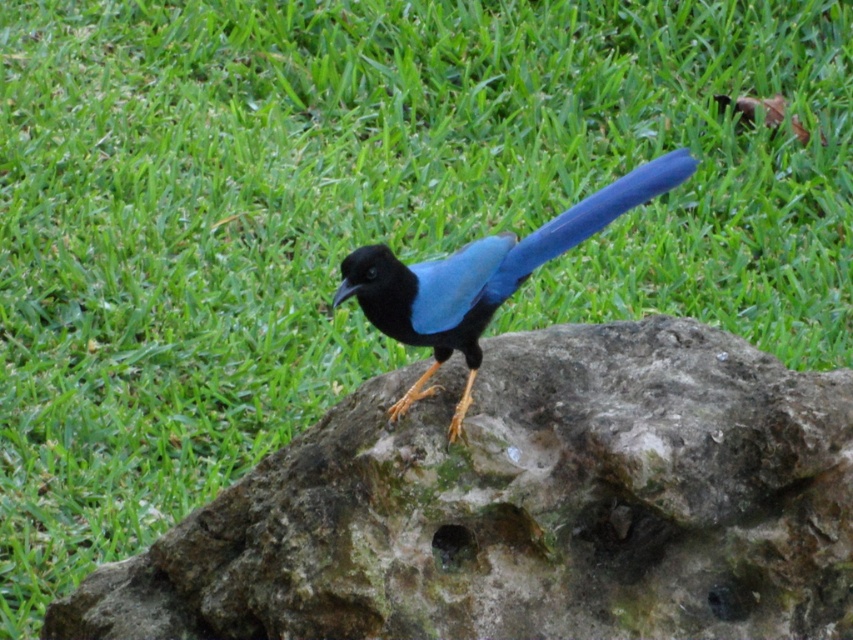
Based on the photo, can you confirm if rough stone boulder at center is taller than glossy blue bird at center?

Correct, rough stone boulder at center is much taller as glossy blue bird at center.

Is point (643, 568) positioned after point (440, 356)?

No, it is not.

Is point (608, 412) closer to camera compared to point (515, 284)?

No, it is not.

Locate an element on the screen. This screenshot has height=640, width=853. rough stone boulder at center is located at coordinates (525, 506).